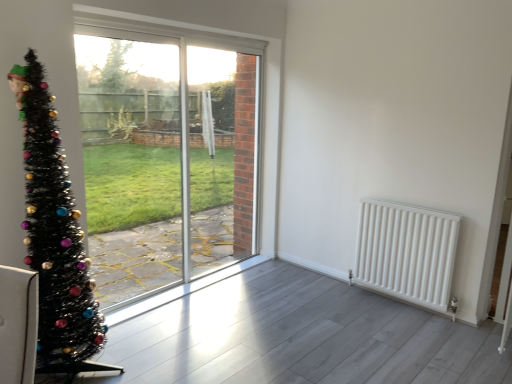
At what (x,y) coordinates should I click in order to perform the action: click on vacant space that's between white matte radiator at right and transparent glass window at center. Please return your answer as a coordinate pair (x, y). Image resolution: width=512 pixels, height=384 pixels. Looking at the image, I should click on (271, 299).